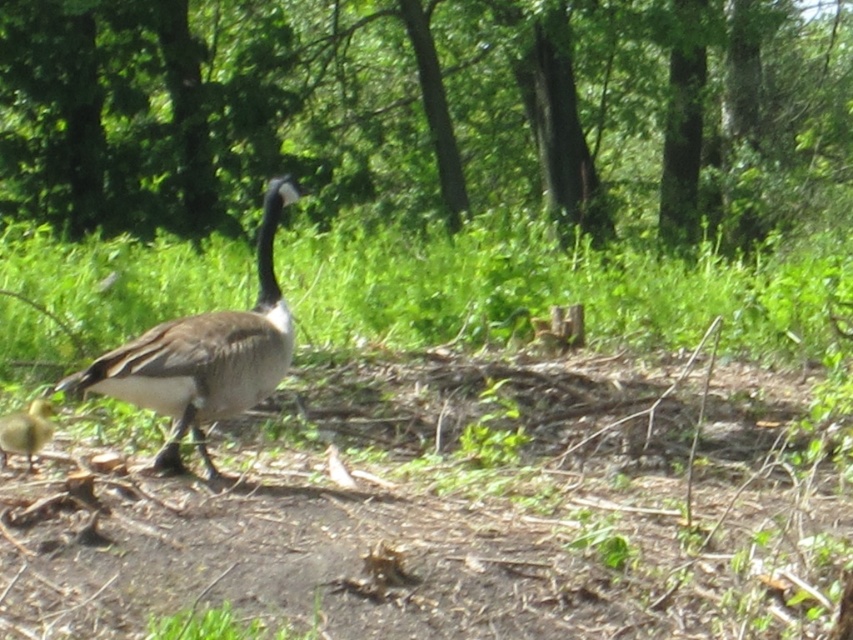
Question: Does green leafy tree at upper center have a greater width compared to brown feathered goose at center?

Choices:
 (A) no
 (B) yes

Answer: (B)

Question: Which of the following is the farthest from the observer?

Choices:
 (A) (654, 113)
 (B) (207, 611)
 (C) (9, 417)
 (D) (389, 330)

Answer: (A)

Question: Among these points, which one is farthest from the camera?

Choices:
 (A) (316, 625)
 (B) (28, 449)
 (C) (293, 259)

Answer: (C)

Question: Is green leafy tree at upper center thinner than brown downy gosling at lower left?

Choices:
 (A) no
 (B) yes

Answer: (A)

Question: In this image, where is green leafy tree at upper center located relative to brown feathered goose at center?

Choices:
 (A) right
 (B) left

Answer: (A)

Question: Which point is closer to the camera?

Choices:
 (A) (241, 628)
 (B) (305, 170)
 (C) (61, 275)

Answer: (A)